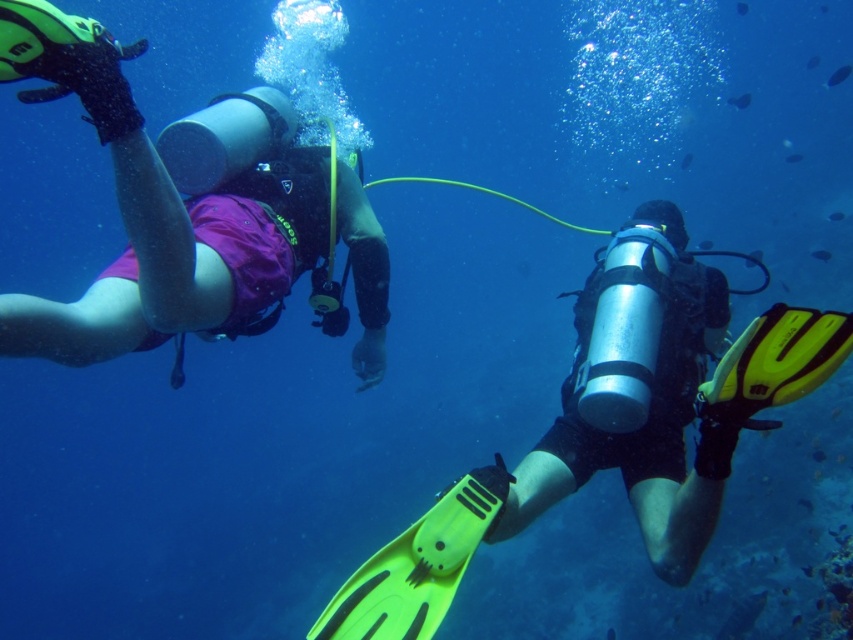
Does matte purple shorts at left have a smaller size compared to matte silver cylinder at center?

Yes, matte purple shorts at left is smaller than matte silver cylinder at center.

Which is more to the left, matte purple shorts at left or matte silver cylinder at center?

matte purple shorts at left is more to the left.

At what (x,y) coordinates should I click in order to perform the action: click on matte purple shorts at left. Please return your answer as a coordinate pair (x, y). This screenshot has width=853, height=640. Looking at the image, I should click on (148, 212).